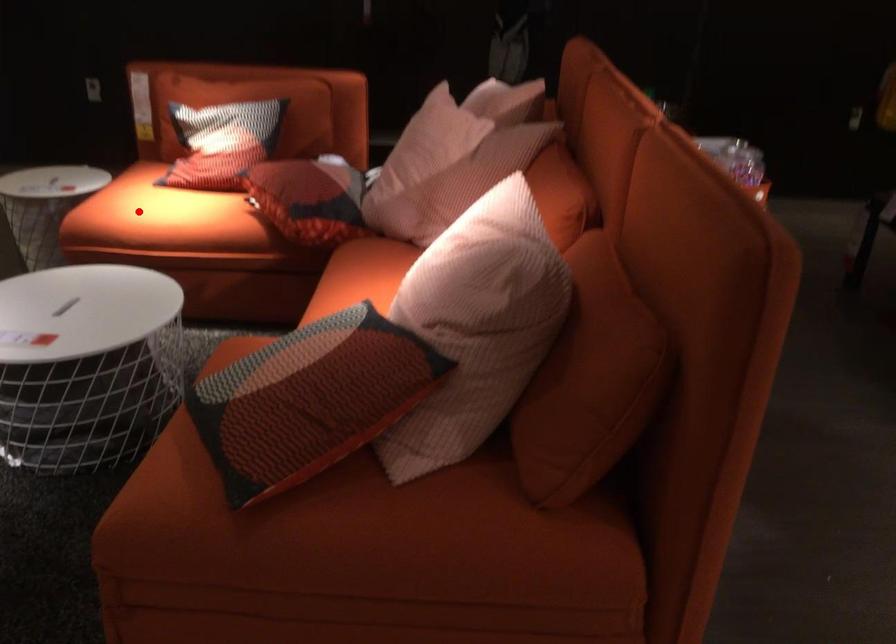
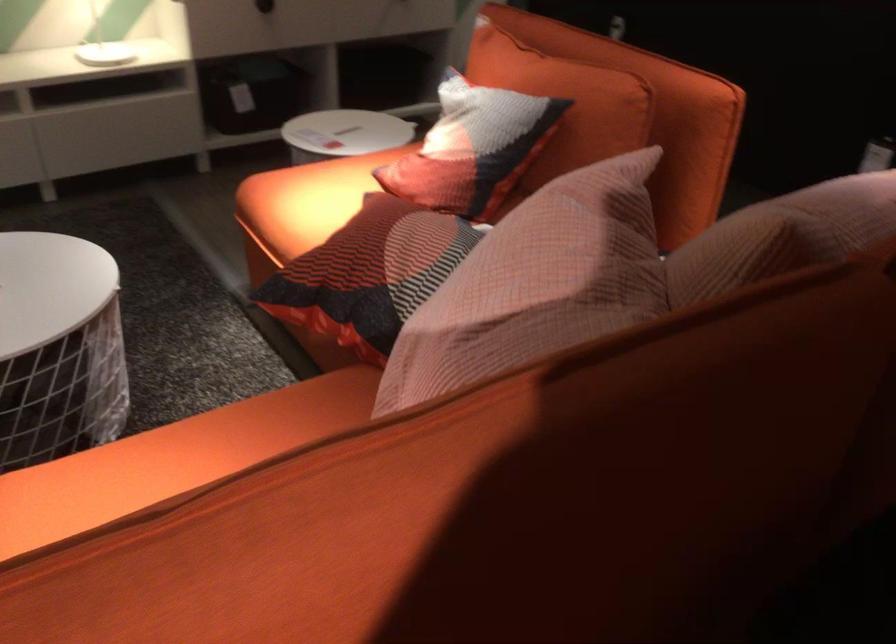
Question: I am providing you with two images of the same scene from different viewpoints. A red point is shown in image1. For the corresponding object point in image2, is it positioned nearer or farther from the camera?

Choices:
 (A) Nearer
 (B) Farther

Answer: (A)